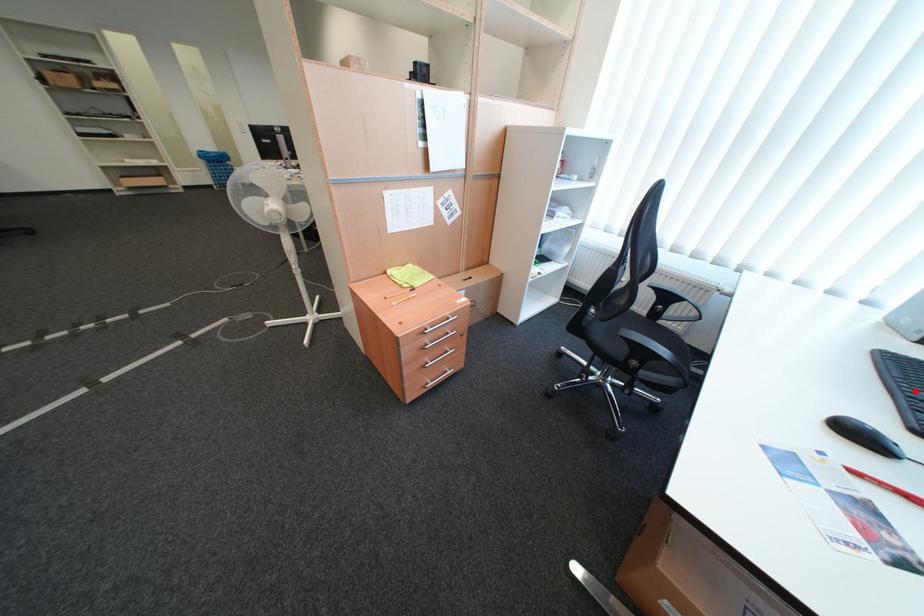
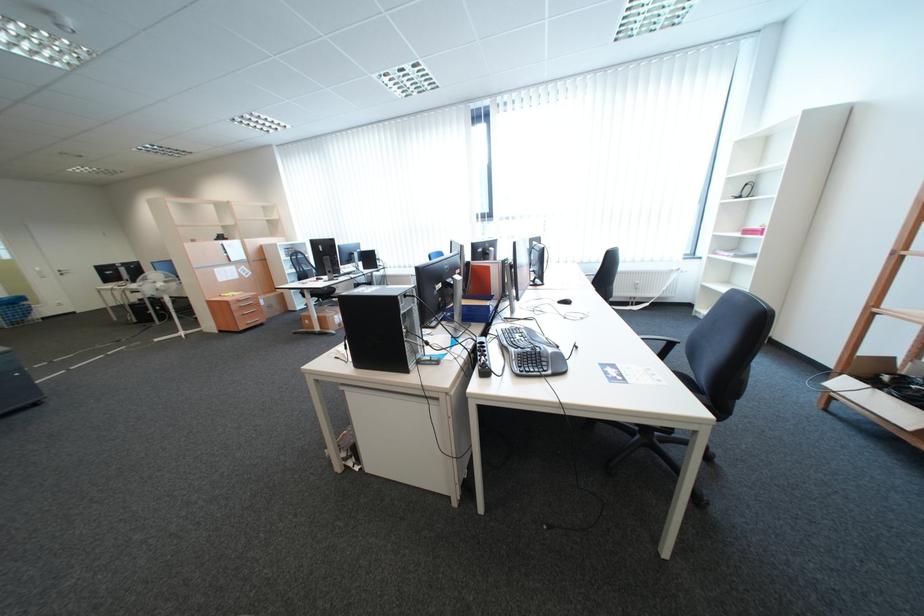
Question: I am providing you with two images of the same scene from different viewpoints. A red point is marked on the first image. Can you still see the location of the red point in image 2?

Choices:
 (A) Yes
 (B) No

Answer: (B)